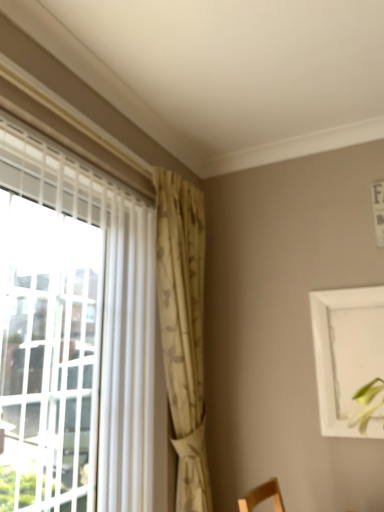
Question: Is point (178, 379) closer or farther from the camera than point (375, 342)?

Choices:
 (A) farther
 (B) closer

Answer: (B)

Question: Visually, is beige textured curtain at center positioned to the left or to the right of white matte picture frame at upper right?

Choices:
 (A) right
 (B) left

Answer: (B)

Question: From the image's perspective, relative to white matte picture frame at upper right, is beige textured curtain at center above or below?

Choices:
 (A) below
 (B) above

Answer: (B)

Question: Considering the positions of white matte picture frame at upper right and beige textured curtain at center in the image, is white matte picture frame at upper right wider or thinner than beige textured curtain at center?

Choices:
 (A) wide
 (B) thin

Answer: (B)

Question: From the image's perspective, is white matte picture frame at upper right positioned above or below beige textured curtain at center?

Choices:
 (A) above
 (B) below

Answer: (B)

Question: Relative to beige textured curtain at center, is white matte picture frame at upper right in front or behind?

Choices:
 (A) front
 (B) behind

Answer: (B)

Question: Considering the positions of point (319, 330) and point (165, 238), is point (319, 330) closer or farther from the camera than point (165, 238)?

Choices:
 (A) closer
 (B) farther

Answer: (B)